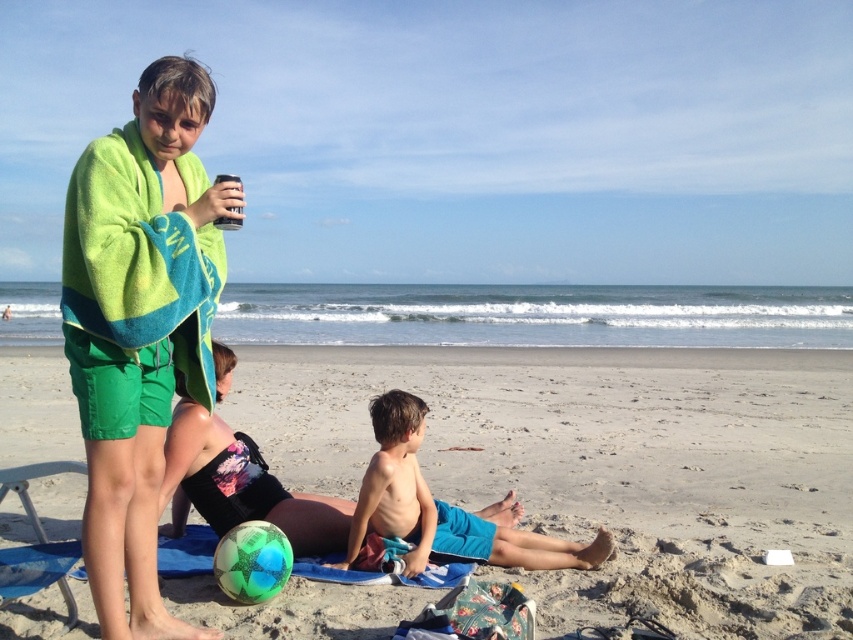
Question: Is the position of black fabric bikini bottom at lower left less distant than that of smooth skin boy at center?

Choices:
 (A) yes
 (B) no

Answer: (A)

Question: Among these objects, which one is farthest from the camera?

Choices:
 (A) black fabric bikini bottom at lower left
 (B) black plastic can at upper center

Answer: (A)

Question: Which point is closer to the camera taking this photo?

Choices:
 (A) (572, 464)
 (B) (222, 180)
 (C) (161, 164)
 (D) (401, 499)

Answer: (B)

Question: Does sandy beach at lower center have a lesser width compared to black plastic can at upper center?

Choices:
 (A) no
 (B) yes

Answer: (B)

Question: Does sandy beach at lower center have a larger size compared to black fabric bikini bottom at lower left?

Choices:
 (A) no
 (B) yes

Answer: (B)

Question: Which is nearer to the sandy beach at lower center?

Choices:
 (A) green towel at left
 (B) black plastic can at upper center

Answer: (B)